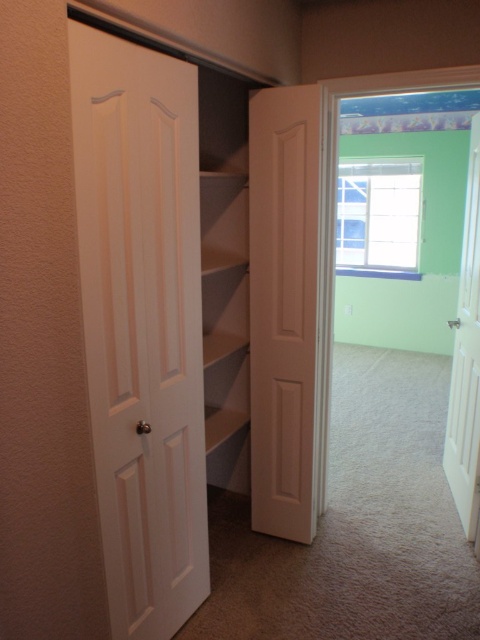
You are a delivery person carrying a package that requires a clear path of at least 1.6 meters to maneuver safely. You need to move a cart through the hallway between the white matte door at left and the white wooden door at right. Can you safely navigate this path with your cart?

The distance between the white matte door at left and white wooden door at right is 1.58 meters, which is slightly less than the required 1.6 meters. Therefore, navigating the path with the cart may be challenging and not entirely safe due to the insufficient clearance.

You are standing in the hallway and want to enter the room with the soft green walls. Which door should you go through, the white matte door at left or the white wooden door at right?

The white wooden door at right leads to the room with the soft green walls because the white matte door at left is closer to the viewer and likely leads to the staircase revealed through its ajar position.

You are a delivery person carrying a large package that requires a doorway at least 3 feet wide to pass through. You see the white matte door at center and the white wooden door at right. Which door can you use to enter the room?

The white matte door at center is wider than the white wooden door at right, so the white matte door at center can accommodate the large package requiring a 3 feet wide doorway.